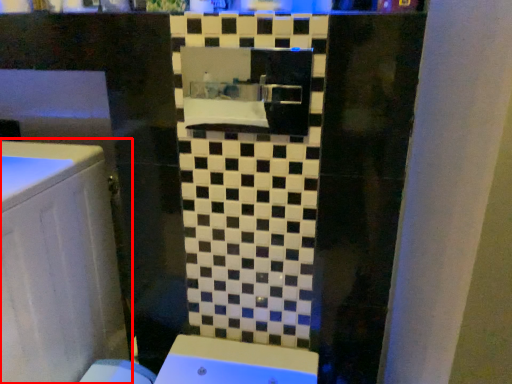
Question: From the image's perspective, where is bathroom cabinet (annotated by the red box) located relative to medicine cabinet?

Choices:
 (A) above
 (B) below

Answer: (B)